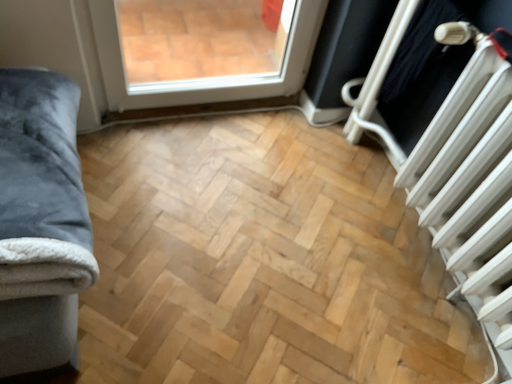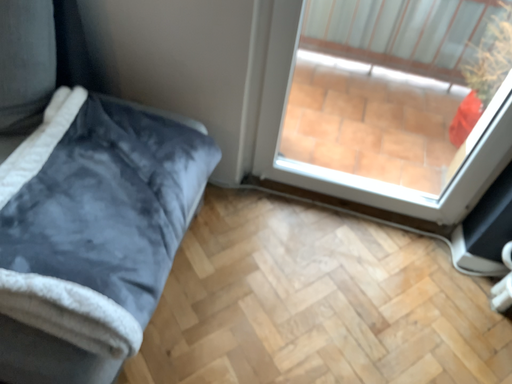
Question: Which way did the camera rotate in the video?

Choices:
 (A) rotated upward
 (B) rotated downward

Answer: (A)